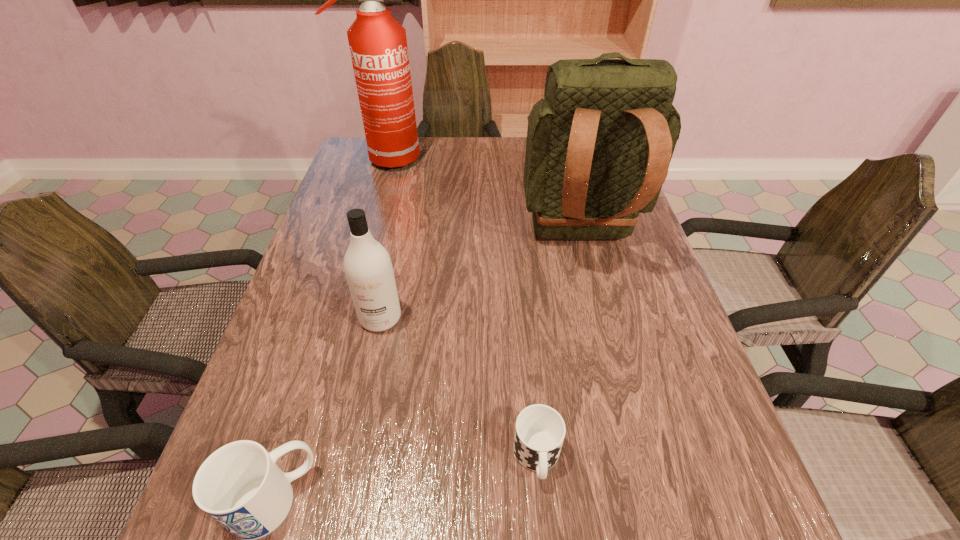
The height and width of the screenshot is (540, 960). Find the location of `vacant space that's between the backpack and the third farthest object`. vacant space that's between the backpack and the third farthest object is located at coordinates (481, 278).

The width and height of the screenshot is (960, 540). Find the location of `vacant area that lies between the third nearest object and the farthest object`. vacant area that lies between the third nearest object and the farthest object is located at coordinates (382, 239).

Locate an element on the screen. Image resolution: width=960 pixels, height=540 pixels. vacant space that's between the shortest object and the fourth nearest object is located at coordinates (559, 347).

Where is `free space between the shortest object and the tallest object`? The height and width of the screenshot is (540, 960). free space between the shortest object and the tallest object is located at coordinates (461, 308).

Identify the location of unoccupied position between the third farthest object and the farthest object. This screenshot has height=540, width=960. (382, 239).

Identify the location of vacant space in between the shortest object and the backpack. (559, 347).

What are the coordinates of `empty location between the third farthest object and the backpack` in the screenshot? It's located at (481, 278).

I want to click on object identified as the second closest to the shortest object, so click(x=240, y=486).

Where is `object that is the second nearest to the second farthest object`? The width and height of the screenshot is (960, 540). object that is the second nearest to the second farthest object is located at coordinates (378, 45).